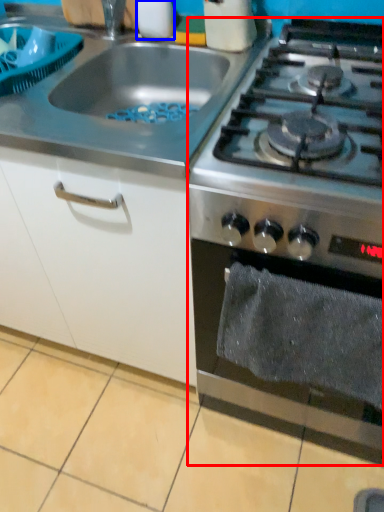
Question: Among these objects, which one is farthest to the camera, gas stove (highlighted by a red box) or kitchen appliance (highlighted by a blue box)?

Choices:
 (A) gas stove
 (B) kitchen appliance

Answer: (B)